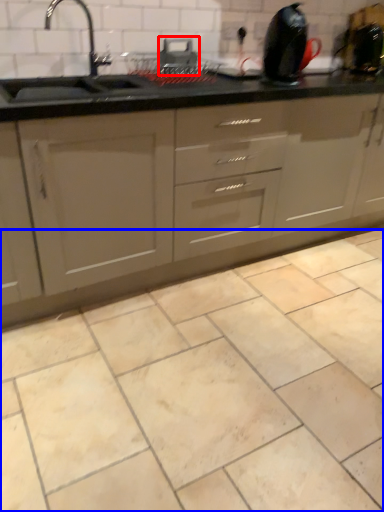
Question: Which of the following is the farthest to the observer, appliance (highlighted by a red box) or ceramic tile (highlighted by a blue box)?

Choices:
 (A) appliance
 (B) ceramic tile

Answer: (A)